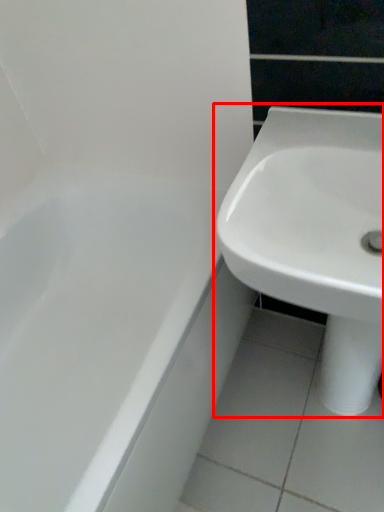
Question: From the image's perspective, considering the relative positions of sink (annotated by the red box) and bathtub in the image provided, where is sink (annotated by the red box) located with respect to the staircase?

Choices:
 (A) above
 (B) below

Answer: (A)